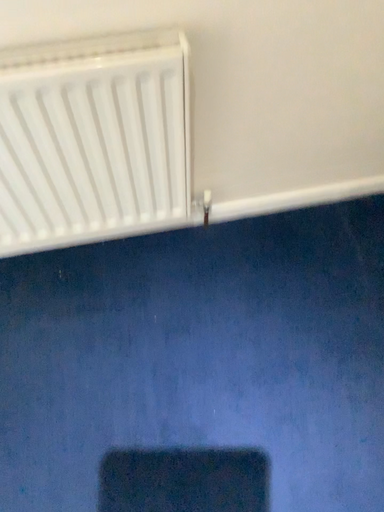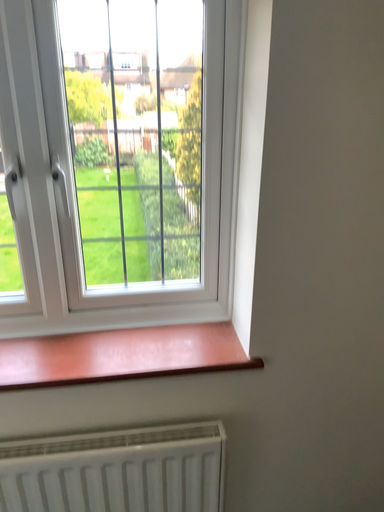
Question: Which way did the camera rotate in the video?

Choices:
 (A) rotated downward
 (B) rotated upward

Answer: (B)